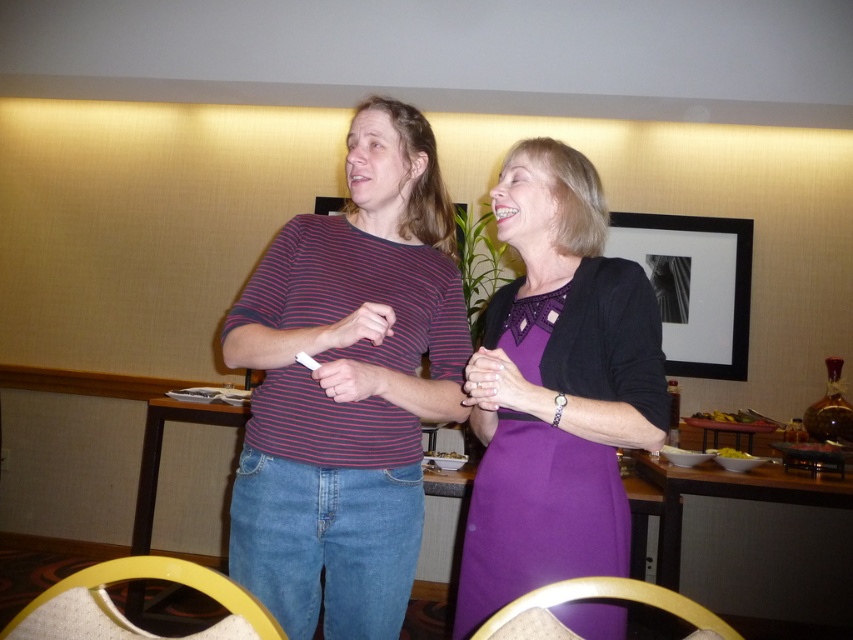
Question: Is striped cotton shirt at center to the left of purple satin dress at center from the viewer's perspective?

Choices:
 (A) yes
 (B) no

Answer: (A)

Question: Is striped cotton shirt at center positioned at the back of purple satin dress at center?

Choices:
 (A) no
 (B) yes

Answer: (A)

Question: Among these objects, which one is farthest from the camera?

Choices:
 (A) striped cotton shirt at center
 (B) purple satin dress at center

Answer: (B)

Question: Among these objects, which one is nearest to the camera?

Choices:
 (A) purple satin dress at center
 (B) striped cotton shirt at center

Answer: (B)

Question: Which point appears farthest from the camera in this image?

Choices:
 (A) (439, 400)
 (B) (572, 376)

Answer: (A)

Question: Considering the relative positions of striped cotton shirt at center and purple satin dress at center in the image provided, where is striped cotton shirt at center located with respect to purple satin dress at center?

Choices:
 (A) above
 (B) below

Answer: (A)